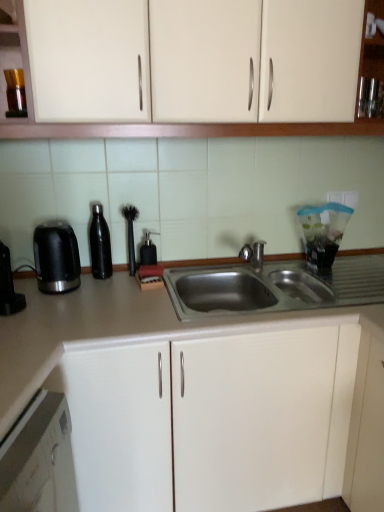
Question: Should I look upward or downward to see matte gray countertop at center?

Choices:
 (A) up
 (B) down

Answer: (B)

Question: Does black plastic coffee machine at left turn towards black rubber brush at center, arranged as the second appliance when viewed from the right?

Choices:
 (A) yes
 (B) no

Answer: (B)

Question: Considering the relative sizes of black plastic coffee machine at left and black rubber brush at center, acting as the second appliance starting from the left, in the image provided, is black plastic coffee machine at left wider than black rubber brush at center, acting as the second appliance starting from the left,?

Choices:
 (A) yes
 (B) no

Answer: (A)

Question: Are black plastic coffee machine at left and black rubber brush at center, arranged as the second appliance when viewed from the right, beside each other?

Choices:
 (A) yes
 (B) no

Answer: (B)

Question: Is black plastic coffee machine at left thinner than black rubber brush at center, arranged as the second appliance when viewed from the right?

Choices:
 (A) no
 (B) yes

Answer: (A)

Question: Is black rubber brush at center, arranged as the second appliance when viewed from the right, at the back of black plastic coffee machine at left?

Choices:
 (A) no
 (B) yes

Answer: (A)

Question: Would you say black plastic coffee machine at left is a long distance from black rubber brush at center, arranged as the second appliance when viewed from the right?

Choices:
 (A) no
 (B) yes

Answer: (A)

Question: Is matte gray countertop at center facing towards black rubber brush at center, arranged as the second appliance when viewed from the right?

Choices:
 (A) no
 (B) yes

Answer: (A)

Question: From a real-world perspective, is matte gray countertop at center physically below black rubber brush at center, arranged as the second appliance when viewed from the right?

Choices:
 (A) no
 (B) yes

Answer: (B)

Question: Can you confirm if matte gray countertop at center is taller than black rubber brush at center, acting as the second appliance starting from the left?

Choices:
 (A) yes
 (B) no

Answer: (A)

Question: Is matte gray countertop at center next to black rubber brush at center, arranged as the second appliance when viewed from the right?

Choices:
 (A) no
 (B) yes

Answer: (A)

Question: Is matte gray countertop at center bigger than black rubber brush at center, arranged as the second appliance when viewed from the right?

Choices:
 (A) yes
 (B) no

Answer: (A)

Question: Considering the relative positions of matte gray countertop at center and black rubber brush at center, arranged as the second appliance when viewed from the right, in the image provided, is matte gray countertop at center behind black rubber brush at center, arranged as the second appliance when viewed from the right,?

Choices:
 (A) yes
 (B) no

Answer: (B)

Question: Can you confirm if black matte water bottle at left, which is the third appliance from right to left, is wider than matte gray countertop at center?

Choices:
 (A) no
 (B) yes

Answer: (A)